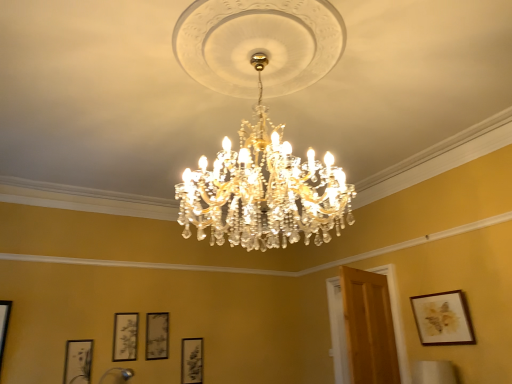
Question: Considering the positions of wooden framed artwork at upper right, the first picture frame positioned from the front, and matte black picture frame at lower left, which is the 2th picture frame from front to back, in the image, is wooden framed artwork at upper right, the first picture frame positioned from the front, wider or thinner than matte black picture frame at lower left, which is the 2th picture frame from front to back,?

Choices:
 (A) wide
 (B) thin

Answer: (A)

Question: Considering their positions, is wooden framed artwork at upper right, which ranks as the 5th picture frame in back-to-front order, located in front of or behind matte black picture frame at lower left, which is the 2th picture frame from front to back?

Choices:
 (A) front
 (B) behind

Answer: (A)

Question: Which object is positioned farthest from the wooden framed artwork at upper right, the first picture frame positioned from the front?

Choices:
 (A) matte black picture frame at lower center, positioned as the third picture frame in right-to-left order
 (B) metallic blue lamp at lower center, acting as the first lamp starting from the bottom
 (C) clear crystal chandelier at center, which is the 2th lamp from left to right
 (D) matte black picture frame at lower center, arranged as the second picture frame when viewed from the right
 (E) matte black picture frame at lower left, acting as the first picture frame starting from the left

Answer: (E)

Question: Estimate the real-world distances between objects in this image. Which object is closer to the metallic blue lamp at lower center, arranged as the second lamp when viewed from the front?

Choices:
 (A) clear crystal chandelier at center, which is the 2th lamp from left to right
 (B) matte black picture frame at lower center, the third picture frame when ordered from back to front
 (C) matte black picture frame at lower center, the 2th picture frame viewed from the back
 (D) matte black picture frame at lower center, the 5th picture frame in the front-to-back sequence
 (E) matte black picture frame at lower left, acting as the first picture frame starting from the left

Answer: (B)